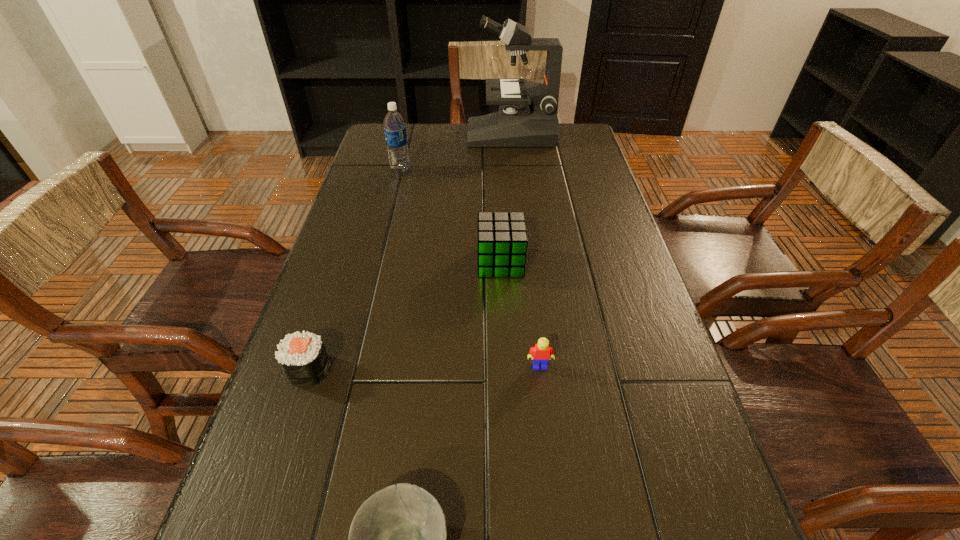
This screenshot has height=540, width=960. Identify the location of free spot located 0.080m through the eyepieces of the microscope. (445, 134).

This screenshot has width=960, height=540. I want to click on vacant space located on the right of the fifth object from right to left, so click(466, 171).

The image size is (960, 540). Find the location of `free space located 0.160m on the left of the third farthest object`. free space located 0.160m on the left of the third farthest object is located at coordinates (411, 262).

Find the location of a particular element. This screenshot has width=960, height=540. vacant position located on the front-facing side of the Lego is located at coordinates (554, 490).

This screenshot has width=960, height=540. In order to click on vacant space positioned 0.160m on the back of the leftmost object in this screenshot , I will do `click(333, 294)`.

The height and width of the screenshot is (540, 960). I want to click on object that is at the far edge, so [x=527, y=116].

Find the location of a particular element. This screenshot has height=540, width=960. water bottle present at the left edge is located at coordinates (394, 124).

Identify the location of sushi that is at the left edge. (302, 356).

Identify the location of object positioned at the right edge. The width and height of the screenshot is (960, 540). (527, 116).

You are a GUI agent. You are given a task and a screenshot of the screen. Output one action in this format:
    pyautogui.click(x=<x>, y=<y>)
    Task: Click on the object that is at the far right corner
    Image resolution: width=960 pixels, height=540 pixels.
    Given the screenshot: What is the action you would take?
    pyautogui.click(x=527, y=116)